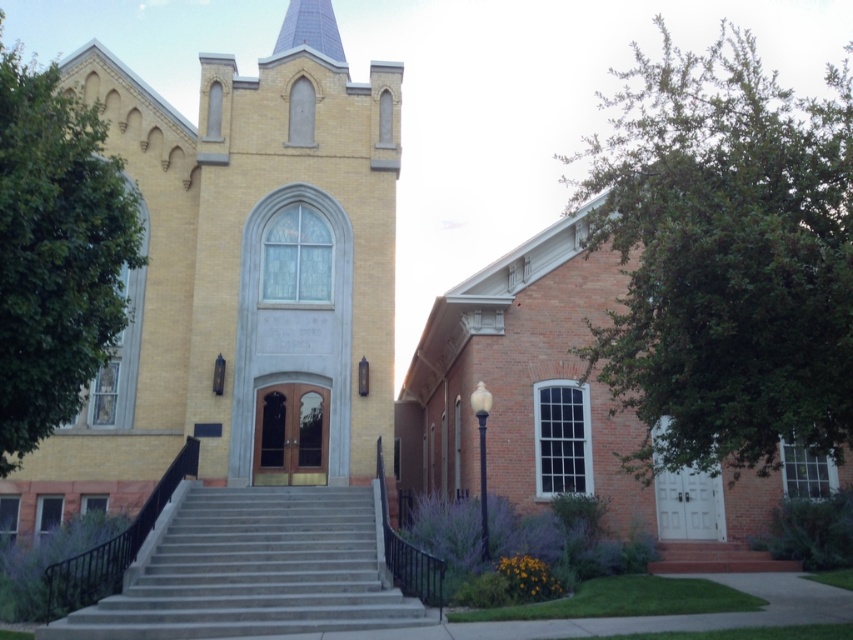
You are standing in front of the church and want to take a photo that includes both the yellow brick church at center and the green leafy tree at right. Which object should be placed closer to the camera to ensure both fit in the frame?

The yellow brick church at center is thinner than the green leafy tree at right, so you should place the green leafy tree at right closer to the camera to ensure both fit in the frame.

You are standing in front of the yellow brick church at center and want to enter through the main entrance. Are the gray concrete stairs at center blocking your path to the entrance?

The gray concrete stairs at center is behind the yellow brick church at center, so they are not blocking your path to the entrance.

You are standing in front of the church and notice a specific point marked at coordinates (238, 288). Based on the scene description, can you determine which part of the church this point is located on?

The point at coordinates (238, 288) is located on the yellow brick church at center.